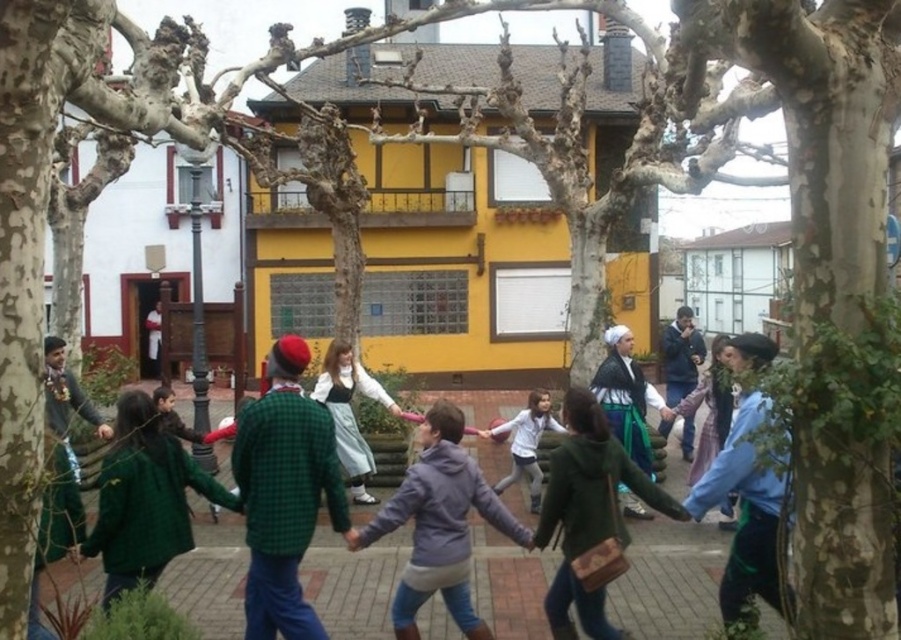
Is green woolen dress at center thinner than blue denim jacket at center?

Correct, green woolen dress at center's width is less than blue denim jacket at center's.

Is point (629, 513) positioned in front of point (669, 401)?

That is True.

Image resolution: width=901 pixels, height=640 pixels. Identify the location of green woolen dress at center. (626, 396).

Is green wool sweater at center below blue-green fabric skirt at center?

Indeed, green wool sweater at center is positioned under blue-green fabric skirt at center.

The height and width of the screenshot is (640, 901). Find the location of `green wool sweater at center`. green wool sweater at center is located at coordinates (144, 497).

Does green plaid shirt at center come in front of purple fleece jacket at center?

Yes, green plaid shirt at center is closer to the viewer.

Can you confirm if green plaid shirt at center is taller than purple fleece jacket at center?

Yes.

Does point (322, 451) lie in front of point (408, 586)?

No, (322, 451) is further to viewer.

In order to click on green plaid shirt at center in this screenshot , I will do `click(284, 493)`.